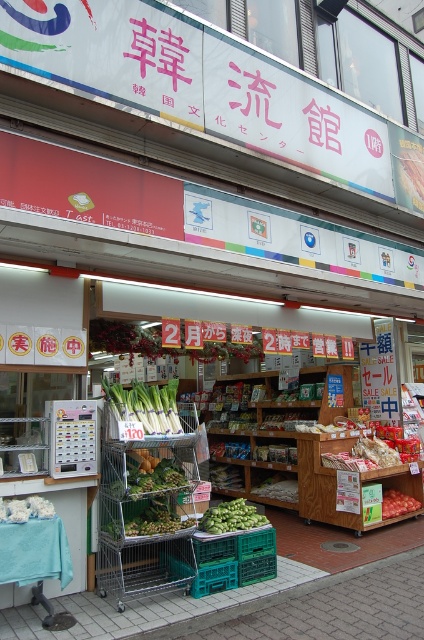
Can you confirm if green matte eggplant at center is wider than smooth red tomato at center?

No.

Which is more to the left, green matte eggplant at center or smooth red tomato at center?

Positioned to the left is green matte eggplant at center.

Is point (217, 516) farther from viewer compared to point (395, 492)?

No, (217, 516) is in front of (395, 492).

Identify the location of green matte eggplant at center. (231, 516).

Can you confirm if green matte leek at center is bigger than green matte eggplant at center?

Indeed, green matte leek at center has a larger size compared to green matte eggplant at center.

Does green matte leek at center have a greater height compared to green matte eggplant at center?

Correct, green matte leek at center is much taller as green matte eggplant at center.

The width and height of the screenshot is (424, 640). I want to click on green matte leek at center, so click(145, 404).

Does green matte leek at center come behind smooth red tomato at center?

No, it is not.

Between green matte leek at center and smooth red tomato at center, which one is positioned higher?

green matte leek at center is higher up.

Which is behind, point (164, 429) or point (384, 496)?

The point (384, 496) is behind.

The width and height of the screenshot is (424, 640). Identify the location of green matte leek at center. (145, 404).